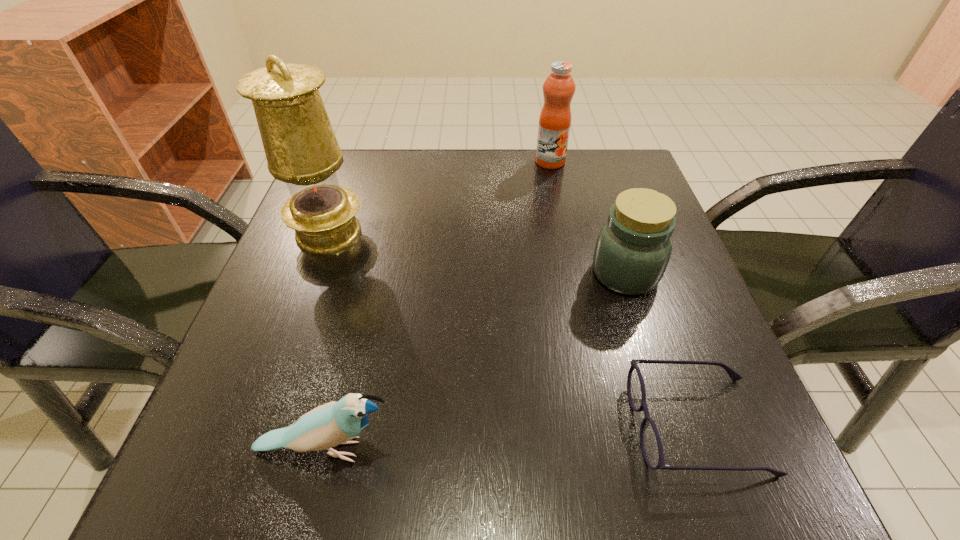
I want to click on vacant area that lies between the jar and the bird, so click(476, 361).

The height and width of the screenshot is (540, 960). In order to click on free point between the farthest object and the oil lamp in this screenshot , I will do `click(440, 197)`.

The width and height of the screenshot is (960, 540). In order to click on vacant space in between the fruit juice and the bird in this screenshot , I will do point(439,306).

Identify the location of free spot between the farthest object and the bird. The height and width of the screenshot is (540, 960). (439, 306).

Where is `free point between the bird and the shortest object`? free point between the bird and the shortest object is located at coordinates (512, 437).

Identify the location of empty space that is in between the oil lamp and the jar. (477, 253).

The height and width of the screenshot is (540, 960). I want to click on vacant space that is in between the bird and the jar, so click(476, 361).

In order to click on free area in between the tallest object and the shortest object in this screenshot , I will do `click(513, 329)`.

The height and width of the screenshot is (540, 960). What are the coordinates of `the closest object to the jar` in the screenshot? It's located at (651, 446).

Locate which object ranks third in proximity to the fruit juice. Please provide its 2D coordinates. Your answer should be formatted as a tuple, i.e. [(x, y)], where the tuple contains the x and y coordinates of a point satisfying the conditions above.

[(651, 446)]